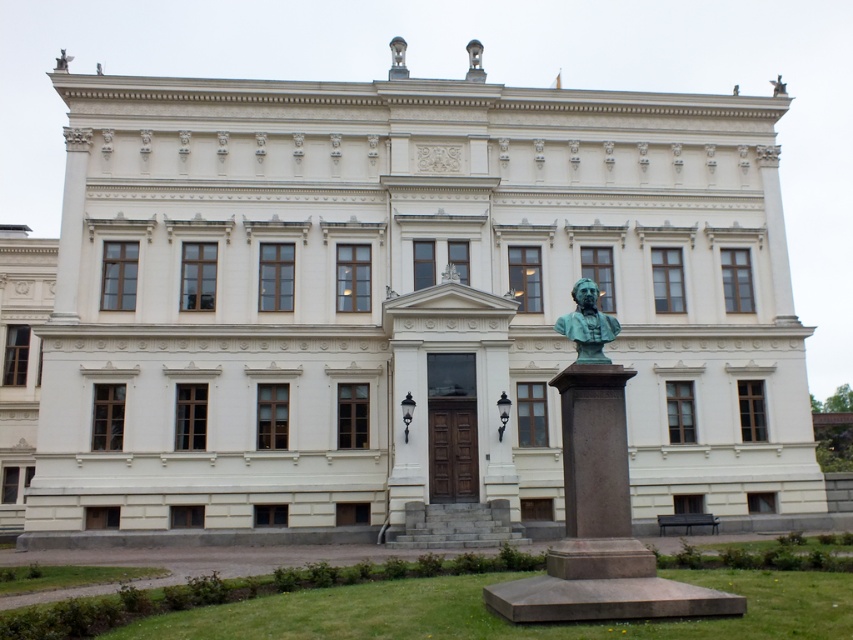
You are an art conservator assessing the spacing between two bronze pieces in front of a neoclassical building. The pieces are the bronze bust at center and the bronze statue at upper center. According to the measurements, which one has a smaller width?

The bronze bust at center has a smaller width than the bronze statue at upper center.

You are an art student visiting the building and want to sketch the statue. The bronze statue at upper center is part of the building, while the bronze bust at center is in front of it. Which one is positioned higher relative to the building?

The bronze statue at upper center is positioned higher than the bronze bust at center because it is part of the building and located at the upper section, while the bust is at the center in front of the building.

You are an art student who needs to determine the relative sizes of two bronze sculptures in front of a classical building. You see the bronze bust at center and the bronze statue at upper center. Which one is taller?

The bronze statue at upper center is taller than the bronze bust at center.